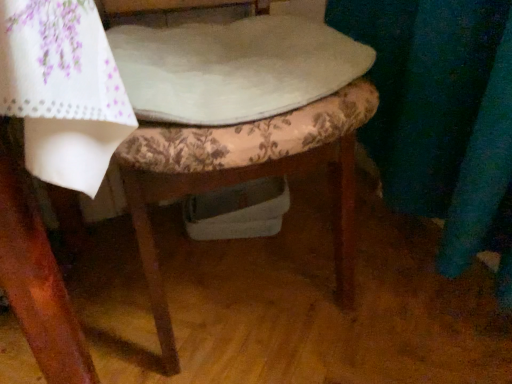
Question: From a real-world perspective, relative to white fabric at center, is floral fabric cushion at center vertically above or below?

Choices:
 (A) below
 (B) above

Answer: (A)

Question: Would you say floral fabric cushion at center is inside or outside white fabric at center?

Choices:
 (A) outside
 (B) inside

Answer: (A)

Question: Is floral fabric cushion at center in front of or behind white fabric at center in the image?

Choices:
 (A) front
 (B) behind

Answer: (A)

Question: Does point (285, 64) appear closer or farther from the camera than point (138, 173)?

Choices:
 (A) closer
 (B) farther

Answer: (B)

Question: Is white fabric at center in front of or behind floral fabric cushion at center in the image?

Choices:
 (A) behind
 (B) front

Answer: (A)

Question: Considering the positions of white fabric at center and floral fabric cushion at center in the image, is white fabric at center wider or thinner than floral fabric cushion at center?

Choices:
 (A) wide
 (B) thin

Answer: (B)

Question: Do you think white fabric at center is within floral fabric cushion at center, or outside of it?

Choices:
 (A) outside
 (B) inside

Answer: (B)